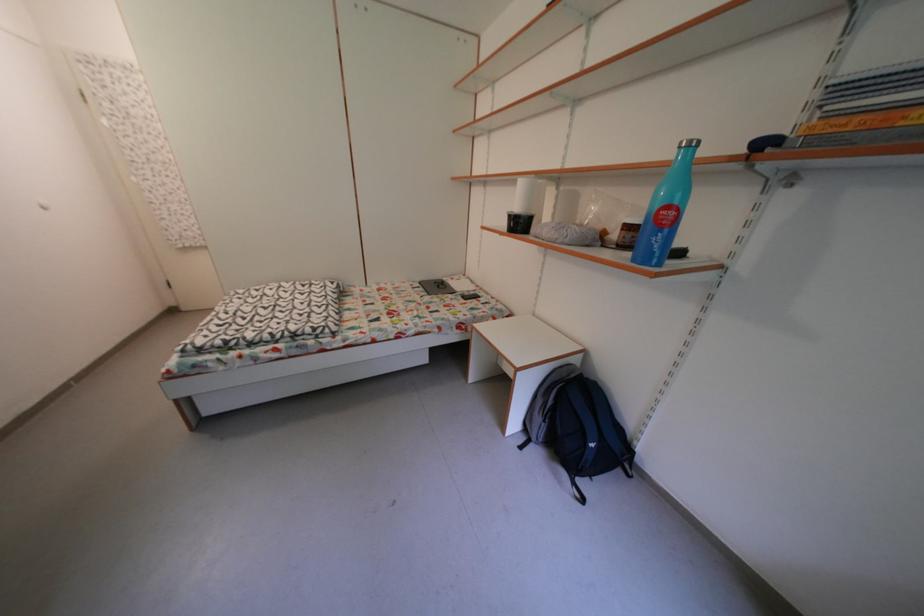
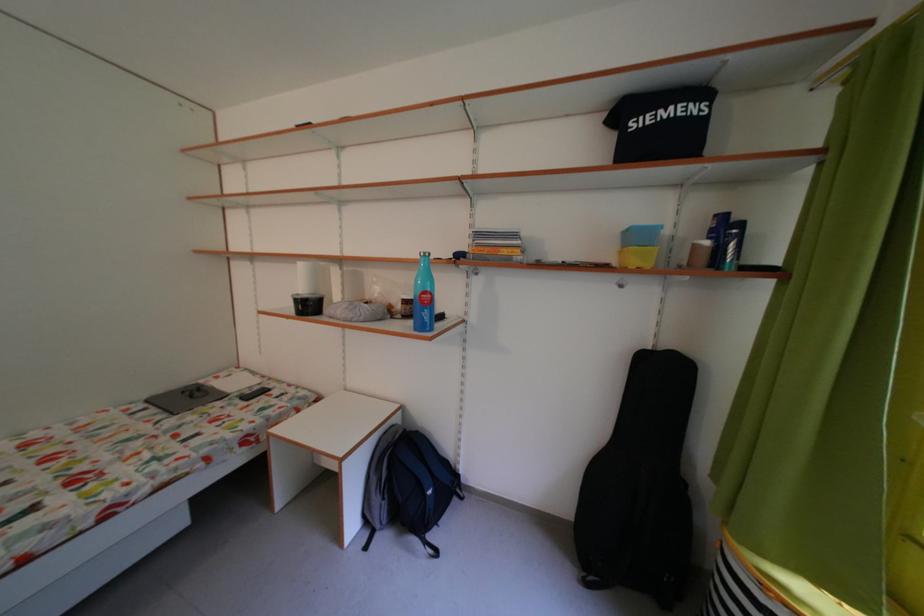
Find the pixel in the second image that matches the point at 553,427 in the first image.

(393, 504)